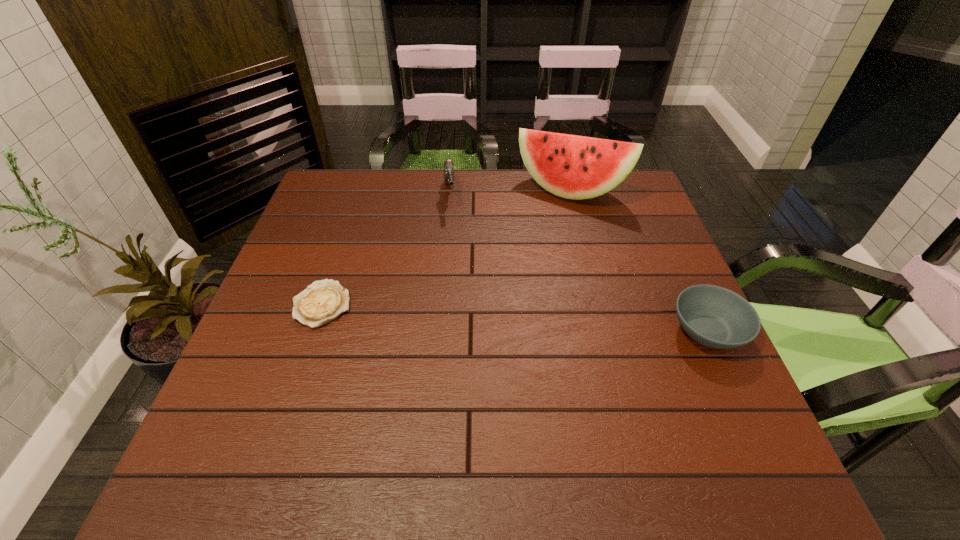
Where is `vacant area that lies between the third tallest object and the third shortest object`? The height and width of the screenshot is (540, 960). vacant area that lies between the third tallest object and the third shortest object is located at coordinates (579, 263).

The image size is (960, 540). In order to click on vacant area between the third object from right to left and the soup bowl in this screenshot , I will do `click(579, 263)`.

This screenshot has height=540, width=960. I want to click on empty location between the soup bowl and the pistol, so click(579, 263).

You are a GUI agent. You are given a task and a screenshot of the screen. Output one action in this format:
    pyautogui.click(x=<x>, y=<y>)
    Task: Click on the vacant area that lies between the pistol and the watermelon
    Image resolution: width=960 pixels, height=540 pixels.
    Given the screenshot: What is the action you would take?
    pyautogui.click(x=510, y=193)

The image size is (960, 540). Find the location of `free space between the tallest object and the shortest object`. free space between the tallest object and the shortest object is located at coordinates (446, 247).

The image size is (960, 540). Identify the location of free point between the second tallest object and the quiche. (386, 249).

Identify which object is the closest to the soup bowl. Please provide its 2D coordinates. Your answer should be formatted as a tuple, i.e. [(x, y)], where the tuple contains the x and y coordinates of a point satisfying the conditions above.

[(575, 167)]

Identify which object is located as the nearest to the shortest object. Please provide its 2D coordinates. Your answer should be formatted as a tuple, i.e. [(x, y)], where the tuple contains the x and y coordinates of a point satisfying the conditions above.

[(449, 170)]

The height and width of the screenshot is (540, 960). I want to click on free space that satisfies the following two spatial constraints: 1. on the front side of the pistol; 2. on the right side of the second shortest object, so click(438, 331).

At what (x,y) coordinates should I click in order to perform the action: click on vacant region that satisfies the following two spatial constraints: 1. on the front side of the shortest object; 2. on the left side of the soup bowl. Please return your answer as a coordinate pair (x, y). This screenshot has height=540, width=960. Looking at the image, I should click on (313, 331).